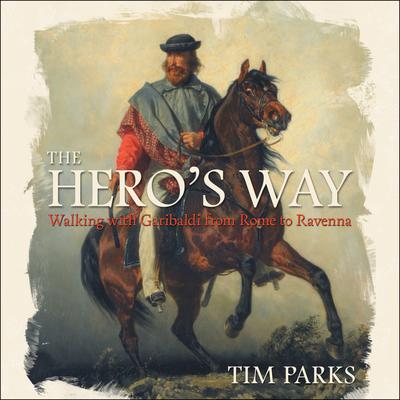
Find the location of a particular element. The width and height of the screenshot is (400, 400). blue cloth is located at coordinates (181, 110).